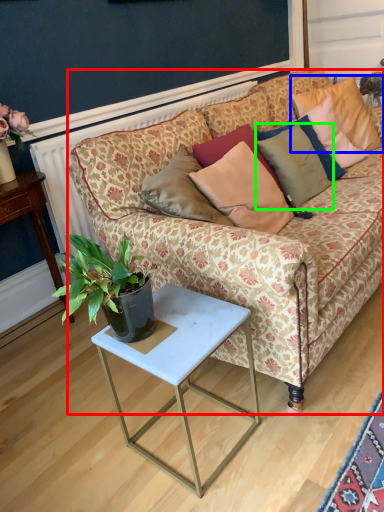
Question: Considering the real-world distances, which object is farthest from studio couch (highlighted by a red box)? pillow (highlighted by a blue box) or pillow (highlighted by a green box)?

Choices:
 (A) pillow
 (B) pillow

Answer: (A)